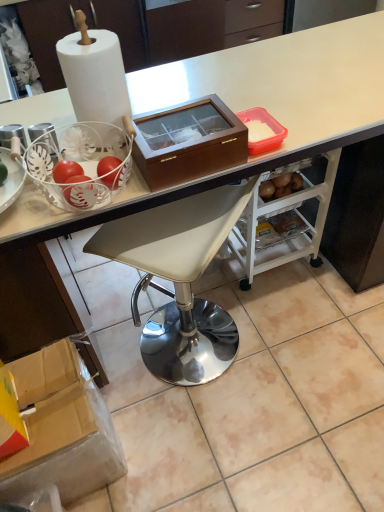
Question: Is cardboard box at lower left, the first box in the left-to-right sequence, in front of or behind brown wooden box at center, the 2th box ordered from the bottom, in the image?

Choices:
 (A) front
 (B) behind

Answer: (B)

Question: From a real-world perspective, relative to brown wooden box at center, acting as the 1th box starting from the top, is cardboard box at lower left, the first box in the left-to-right sequence, vertically above or below?

Choices:
 (A) above
 (B) below

Answer: (B)

Question: Which object is positioned closest to the white glossy desk at upper center?

Choices:
 (A) brown wooden box at center, the second box when ordered from left to right
 (B) white leather stool at center
 (C) cardboard box at lower left, placed as the 1th box when sorted from bottom to top

Answer: (A)

Question: Considering the real-world distances, which object is farthest from the cardboard box at lower left, placed as the 1th box when sorted from bottom to top?

Choices:
 (A) white leather stool at center
 (B) brown wooden box at center, the second box when ordered from left to right
 (C) white glossy desk at upper center

Answer: (B)